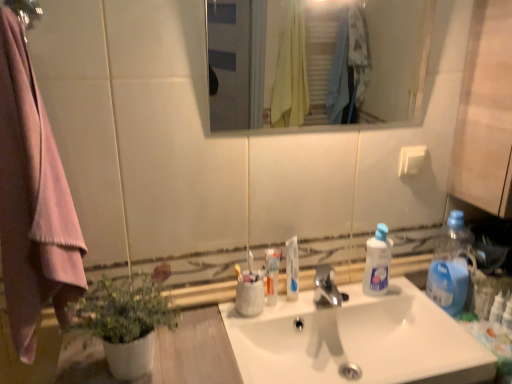
You are a GUI agent. You are given a task and a screenshot of the screen. Output one action in this format:
    pyautogui.click(x=<x>, y=<y>)
    Task: Click on the vacant space underneath green matte plant at lower left (from a real-world perspective)
    
    Given the screenshot: What is the action you would take?
    pyautogui.click(x=147, y=371)